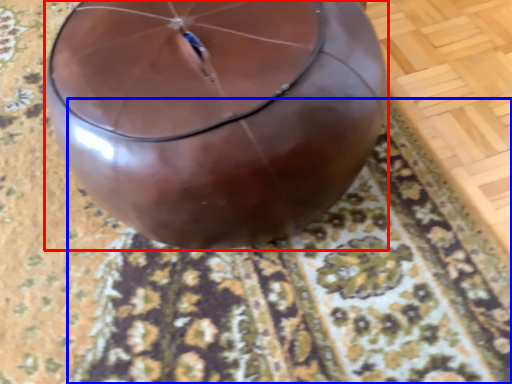
Question: Which point is further to the camera, balloon (highlighted by a red box) or mat (highlighted by a blue box)?

Choices:
 (A) balloon
 (B) mat

Answer: (B)